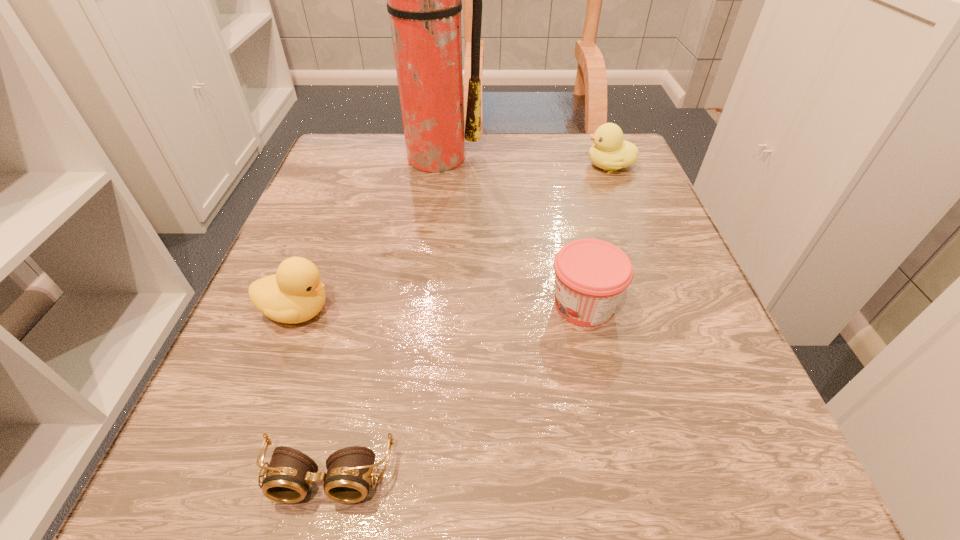
What are the coordinates of `vacant region at the far right corner` in the screenshot? It's located at (576, 136).

The height and width of the screenshot is (540, 960). What are the coordinates of `vacant space at the near right corner of the desktop` in the screenshot? It's located at [x=786, y=481].

Locate an element on the screen. unoccupied area between the fire extinguisher and the fourth object from left to right is located at coordinates (508, 231).

Where is `free space between the goggles and the tallest object`? free space between the goggles and the tallest object is located at coordinates (380, 316).

What are the coordinates of `unoccupied position between the rightmost object and the fire extinguisher` in the screenshot? It's located at click(521, 161).

Where is `unoccupied area between the duck and the goggles`? The image size is (960, 540). unoccupied area between the duck and the goggles is located at coordinates (313, 393).

Find the location of `free space that is in between the second object from right to left and the shortest object`. free space that is in between the second object from right to left and the shortest object is located at coordinates (456, 390).

Find the location of a particular element. Image resolution: width=960 pixels, height=540 pixels. empty location between the duck and the second object from right to left is located at coordinates (441, 308).

Identify the location of vacant area between the goggles and the tallest object. (380, 316).

Find the location of a particular element. The image size is (960, 540). vacant space that's between the jam and the duckling is located at coordinates (597, 235).